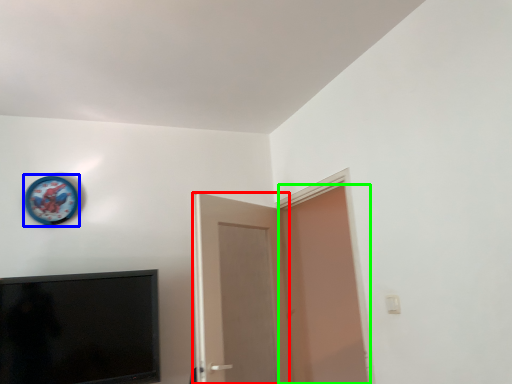
Question: Based on their relative distances, which object is nearer to door (highlighted by a red box)? Choose from clock (highlighted by a blue box) and door (highlighted by a green box).

Choices:
 (A) clock
 (B) door

Answer: (B)